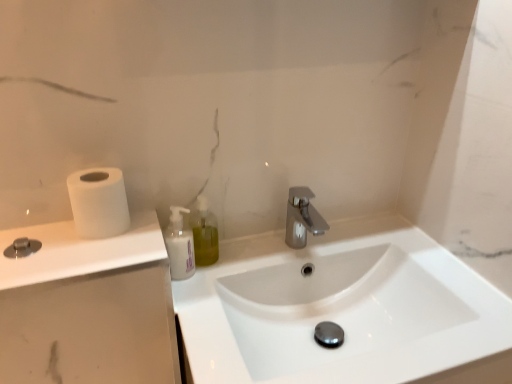
Question: Would you say white matte countertop at left is outside white matte bottle at center?

Choices:
 (A) no
 (B) yes

Answer: (B)

Question: Does white matte countertop at left have a larger size compared to white matte bottle at center?

Choices:
 (A) yes
 (B) no

Answer: (A)

Question: Considering the relative sizes of white matte countertop at left and white matte bottle at center in the image provided, is white matte countertop at left shorter than white matte bottle at center?

Choices:
 (A) yes
 (B) no

Answer: (B)

Question: Considering the relative positions of white matte countertop at left and white matte bottle at center in the image provided, is white matte countertop at left behind white matte bottle at center?

Choices:
 (A) no
 (B) yes

Answer: (A)

Question: Is white matte countertop at left facing away from white matte bottle at center?

Choices:
 (A) yes
 (B) no

Answer: (B)

Question: From the image's perspective, is white glossy sink at center above or below polished chrome faucet at center?

Choices:
 (A) below
 (B) above

Answer: (A)

Question: Is white glossy sink at center bigger or smaller than polished chrome faucet at center?

Choices:
 (A) small
 (B) big

Answer: (B)

Question: Considering their positions, is white glossy sink at center located in front of or behind polished chrome faucet at center?

Choices:
 (A) front
 (B) behind

Answer: (A)

Question: Does point (495, 345) appear closer or farther from the camera than point (290, 208)?

Choices:
 (A) farther
 (B) closer

Answer: (B)

Question: Considering the positions of polished chrome faucet at center and translucent plastic soap dispenser at center in the image, is polished chrome faucet at center wider or thinner than translucent plastic soap dispenser at center?

Choices:
 (A) thin
 (B) wide

Answer: (B)

Question: Based on their sizes in the image, would you say polished chrome faucet at center is bigger or smaller than translucent plastic soap dispenser at center?

Choices:
 (A) small
 (B) big

Answer: (B)

Question: Do you think polished chrome faucet at center is within translucent plastic soap dispenser at center, or outside of it?

Choices:
 (A) inside
 (B) outside

Answer: (B)

Question: Considering the positions of polished chrome faucet at center and translucent plastic soap dispenser at center in the image, is polished chrome faucet at center taller or shorter than translucent plastic soap dispenser at center?

Choices:
 (A) short
 (B) tall

Answer: (A)

Question: From a real-world perspective, is translucent plastic soap dispenser at center above or below white glossy sink at center?

Choices:
 (A) above
 (B) below

Answer: (A)

Question: Is translucent plastic soap dispenser at center bigger or smaller than white glossy sink at center?

Choices:
 (A) big
 (B) small

Answer: (B)